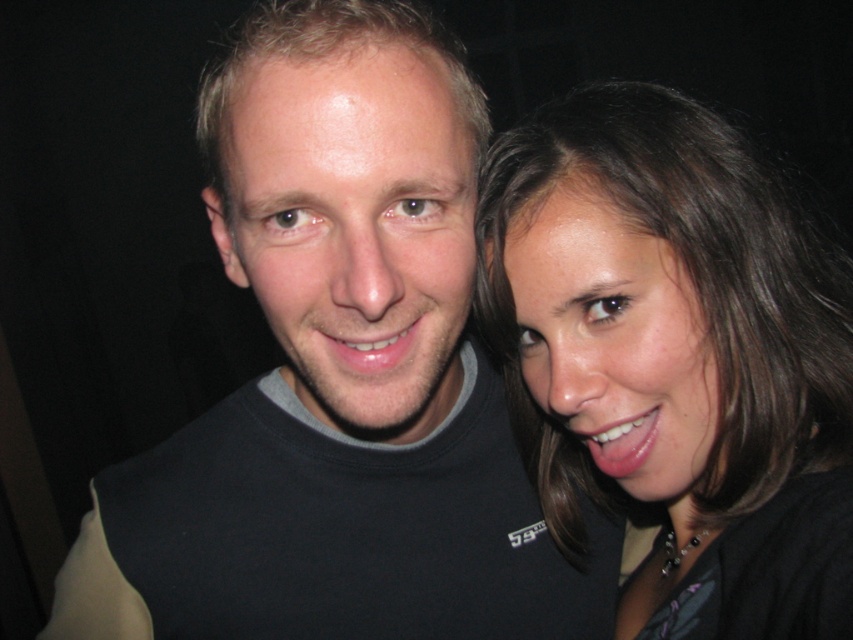
You are taking a photo of two people standing in front of you. You notice two points in the image at coordinates point (289,493) and point (770,472). Which of these points is closer to your camera?

Point (289,493) is closer to the camera than point (770,472) because it is further to the camera than the other point.

You are a photographer trying to focus on the black matte t shirt at center in the image. The camera has a focus point at position (337, 376). Is the focus point correctly placed to capture the black matte t shirt at center?

Yes, the focus point at (337, 376) is correctly placed to capture the black matte t shirt at center as the point indicates the location of the black matte t shirt at center.